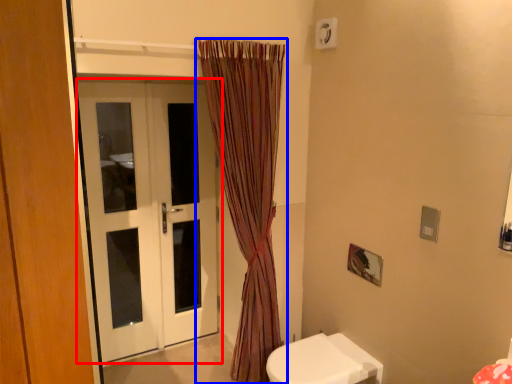
Question: Among these objects, which one is nearest to the camera, door (highlighted by a red box) or curtain (highlighted by a blue box)?

Choices:
 (A) door
 (B) curtain

Answer: (B)